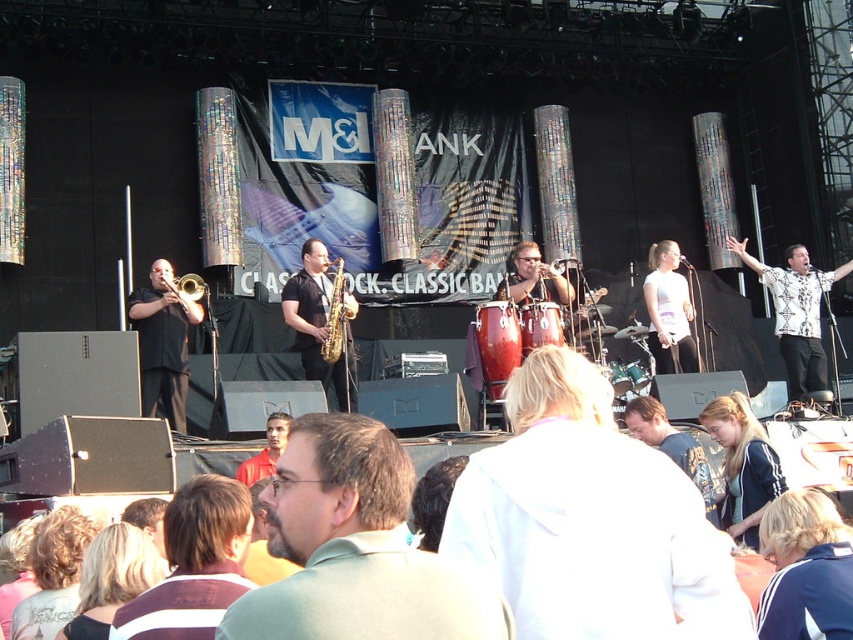
In the scene shown: You are standing at the center of the stage and want to hand a microphone to the person wearing the blue fabric jacket at lower right. In which direction should you move to reach them?

The blue fabric jacket at lower right is located at coordinates point (805, 570), so you should move towards the lower right direction to reach them.

From the picture: You are a photographer at the concert and want to capture the white printed shirt at right. Where should you aim your camera?

You should aim your camera at point (796, 312) to capture the white printed shirt at right.

You are a photographer at the concert. You want to capture a closeup shot of the satin gold saxophone at center without the white printed shirt at right overlapping in the frame. Is this possible given their sizes?

The white printed shirt at right is bigger than the satin gold saxophone at center. Since the shirt is larger, it might block the saxophone if they are positioned in a way that the shirt is closer to the camera. However, without knowing their exact positions, it is uncertain. But based on size alone, the larger shirt could potentially obscure the smaller saxophone in the frame.